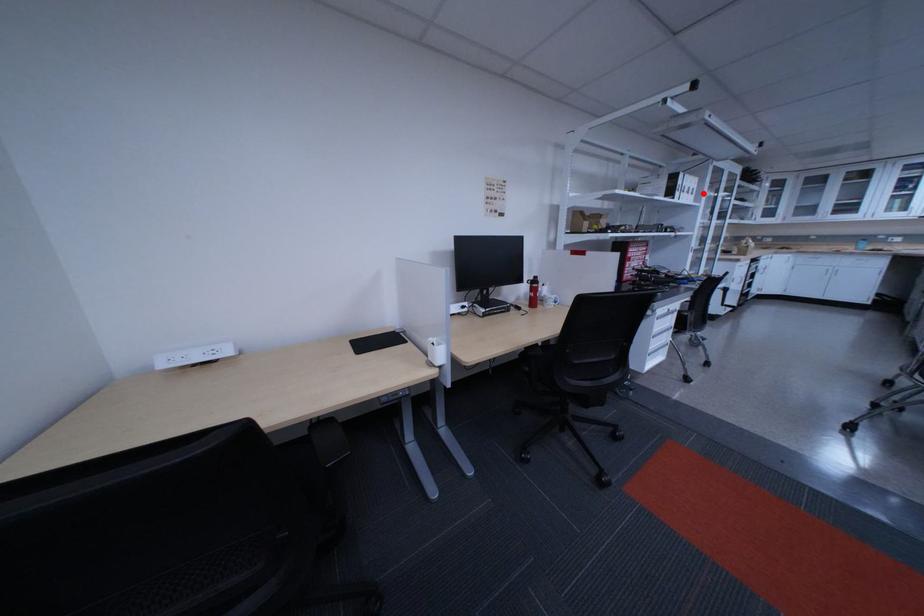
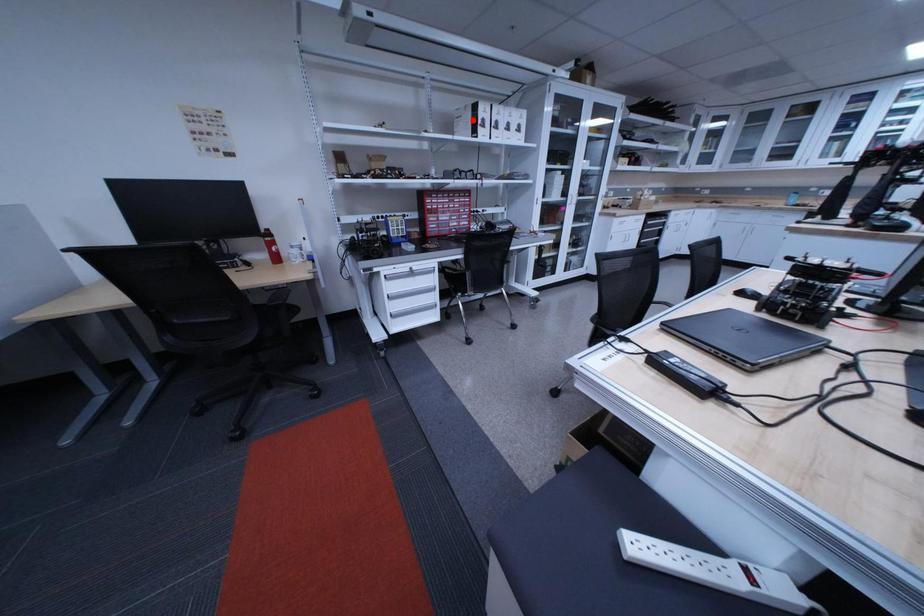
I am providing you with two images of the same scene from different viewpoints. A red point is marked on the first image and another point is marked on the second image. Do the highlighted points in image1 and image2 indicate the same real-world spot?

No